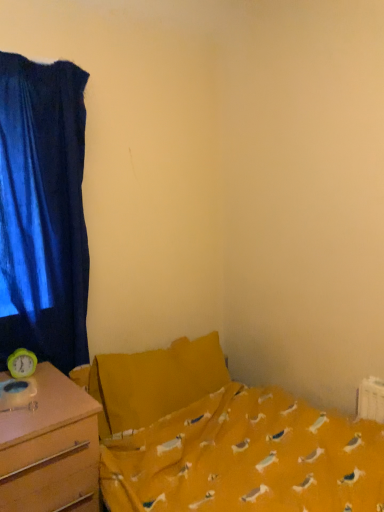
Identify the location of blank space situated above wooden desk at left (from a real-world perspective). [x=34, y=396].